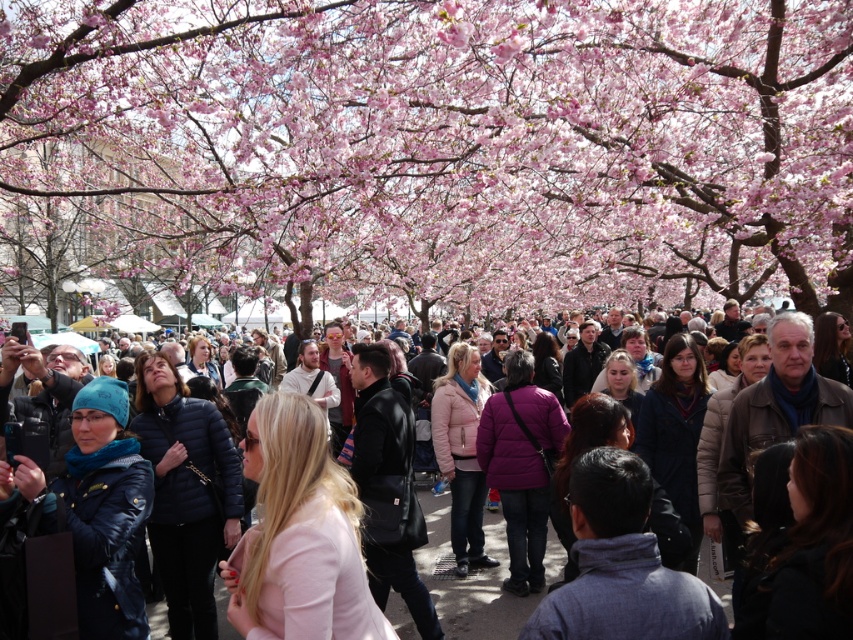
Question: Can you confirm if pink blossoms at center is positioned above matte black jacket at center?

Choices:
 (A) yes
 (B) no

Answer: (A)

Question: Considering the relative positions of pink blossoms at center and matte black jacket at center in the image provided, where is pink blossoms at center located with respect to matte black jacket at center?

Choices:
 (A) below
 (B) above

Answer: (B)

Question: Does pink blossoms at center appear on the right side of matte black jacket at center?

Choices:
 (A) yes
 (B) no

Answer: (A)